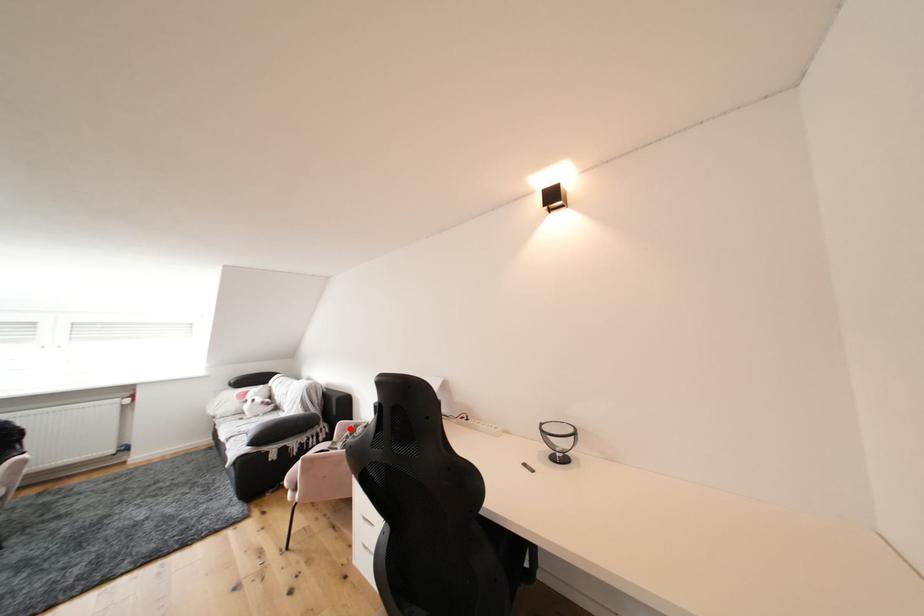
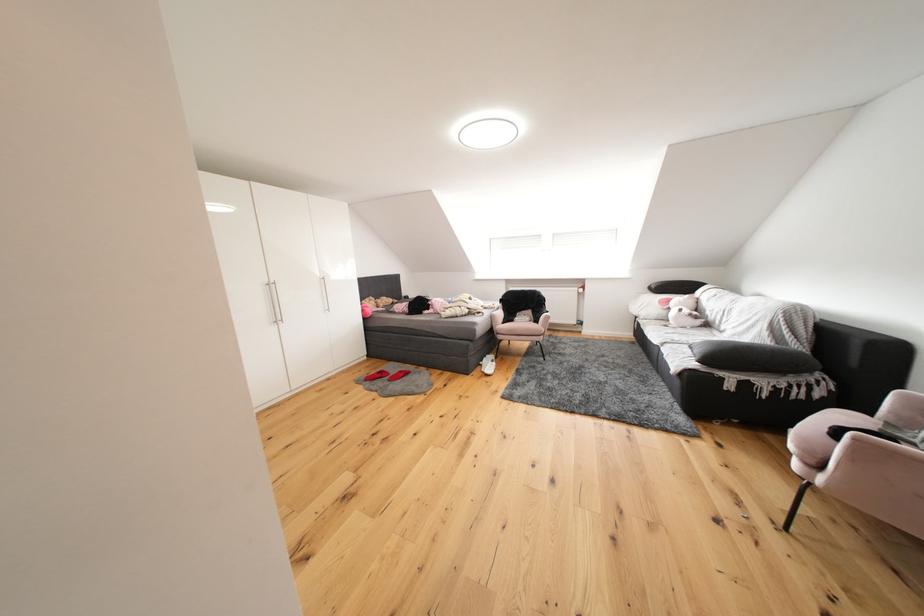
Question: I am providing you with two images of the same scene from different viewpoints. Given a red point in image1, look at the same physical point in image2. Is it:

Choices:
 (A) Closer to the viewpoint
 (B) Farther from the viewpoint

Answer: (A)